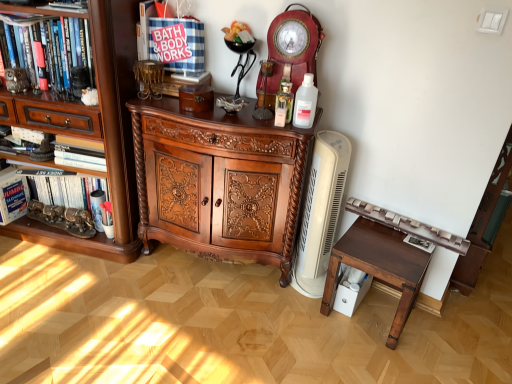
Where is `free space in front of dark wood carved cabinet at center`? The width and height of the screenshot is (512, 384). free space in front of dark wood carved cabinet at center is located at coordinates (203, 326).